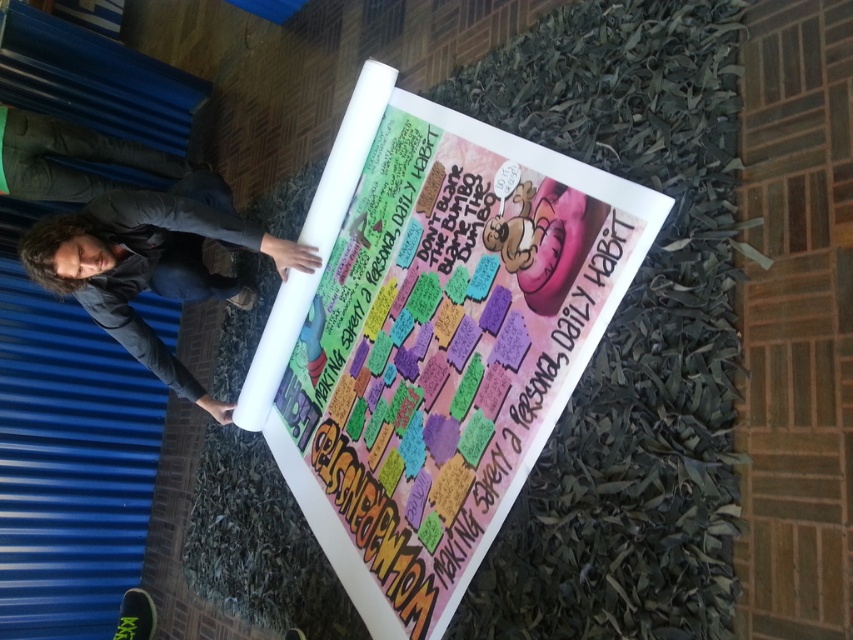
Which is below, multicolored paperboard at center or dark gray jacket at lower left?

multicolored paperboard at center is below.

Is multicolored paperboard at center to the left of dark gray jacket at lower left from the viewer's perspective?

No, multicolored paperboard at center is not to the left of dark gray jacket at lower left.

The image size is (853, 640). What do you see at coordinates (433, 340) in the screenshot?
I see `multicolored paperboard at center` at bounding box center [433, 340].

What are the coordinates of `multicolored paperboard at center` in the screenshot? It's located at (433, 340).